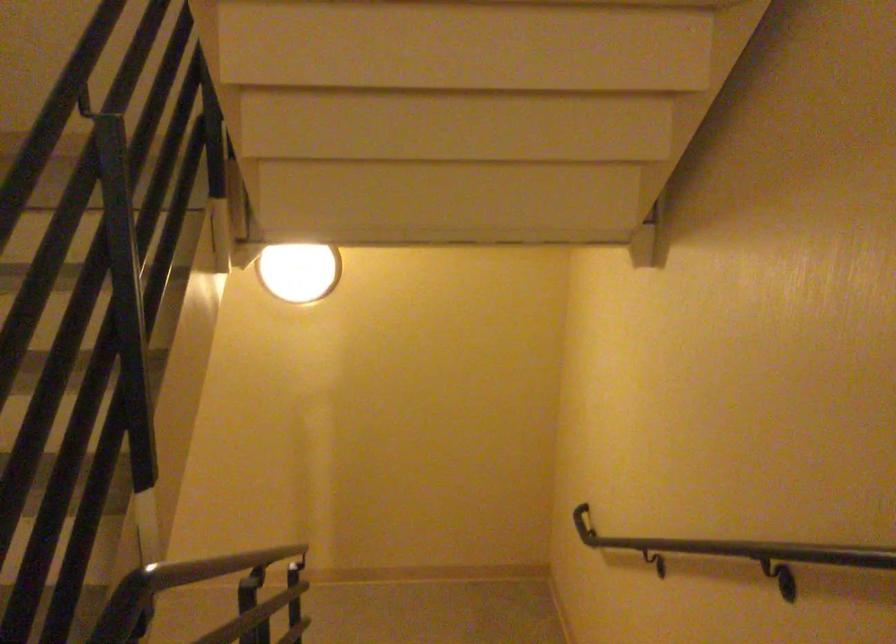
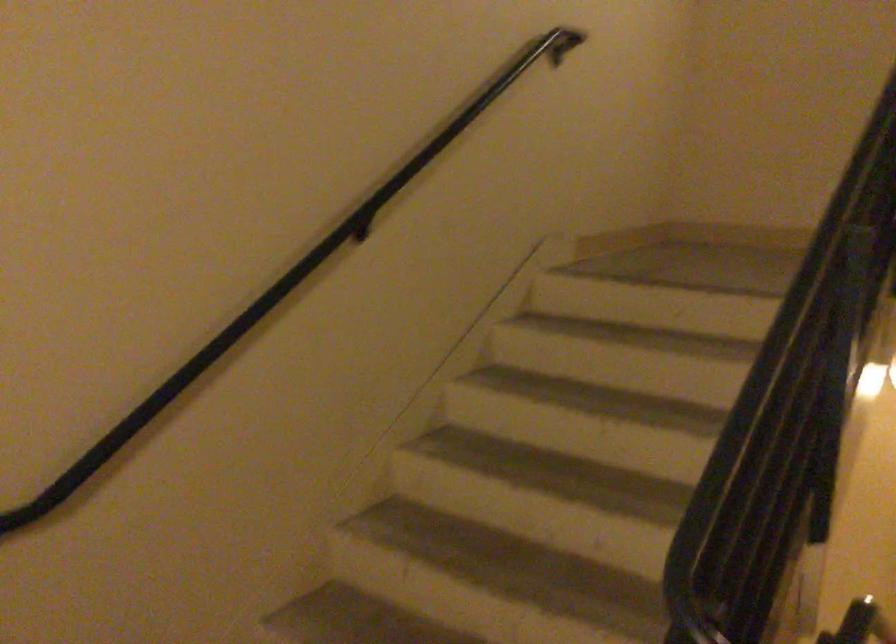
Question: The camera is either moving clockwise (left) or counter-clockwise (right) around the object. The first image is from the beginning of the video and the second image is from the end. Is the camera moving left or right when shooting the video?

Choices:
 (A) Left
 (B) Right

Answer: (B)